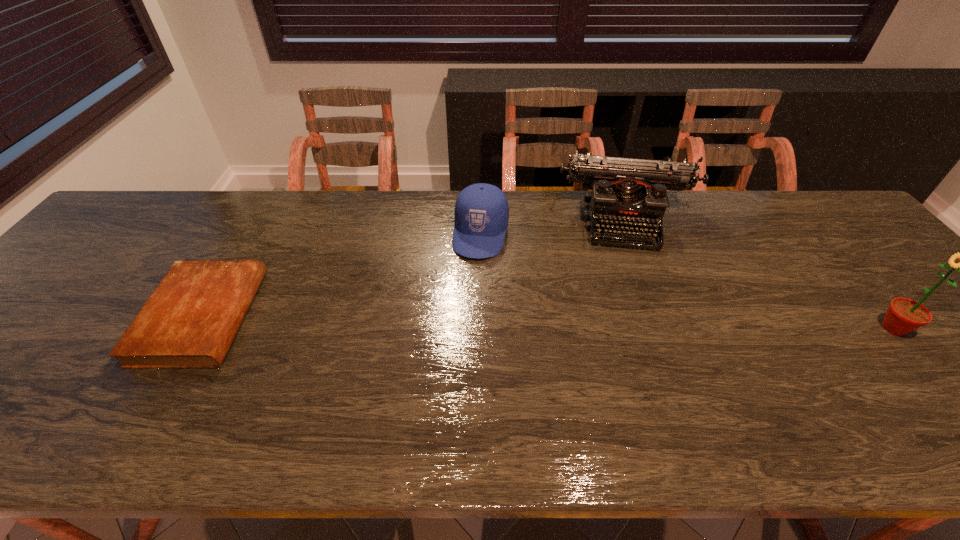
You are a GUI agent. You are given a task and a screenshot of the screen. Output one action in this format:
    pyautogui.click(x=<x>, y=<y>)
    Task: Click on the vacant space that satisfies the following two spatial constraints: 1. on the front side of the sunflower; 2. on the face of the third tallest object
    
    Given the screenshot: What is the action you would take?
    point(481,328)

Identify the location of blank space that satisfies the following two spatial constraints: 1. on the front side of the rightmost object; 2. on the face of the second object from left to right. (481, 328).

I want to click on vacant area that satisfies the following two spatial constraints: 1. on the back side of the second object from left to right; 2. on the left side of the second tallest object, so click(x=481, y=218).